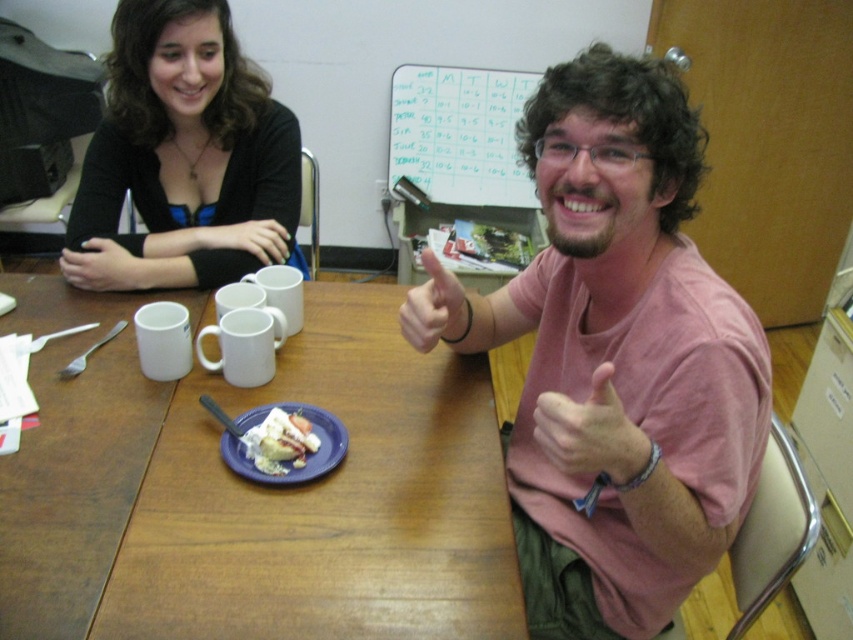
Who is positioned more to the right, pink cotton shirt at center or white creamy cake at center?

Positioned to the right is pink cotton shirt at center.

Is pink cotton shirt at center shorter than white creamy cake at center?

Incorrect, pink cotton shirt at center's height does not fall short of white creamy cake at center's.

Which is behind, point (691, 449) or point (292, 452)?

The point (292, 452) is more distant.

You are a GUI agent. You are given a task and a screenshot of the screen. Output one action in this format:
    pyautogui.click(x=<x>, y=<y>)
    Task: Click on the pink cotton shirt at center
    This screenshot has width=853, height=640.
    Given the screenshot: What is the action you would take?
    pyautogui.click(x=614, y=358)

Does black matte sweater at upper left come in front of matte black arm at upper left?

Yes, black matte sweater at upper left is closer to the viewer.

Can you confirm if black matte sweater at upper left is wider than matte black arm at upper left?

Indeed, black matte sweater at upper left has a greater width compared to matte black arm at upper left.

Is point (119, 67) positioned after point (192, 250)?

Yes, point (119, 67) is farther from viewer.

Image resolution: width=853 pixels, height=640 pixels. I want to click on black matte sweater at upper left, so click(183, 157).

Who is lower down, pink matte hand at center or matte black arm at upper left?

Positioned lower is pink matte hand at center.

This screenshot has height=640, width=853. In order to click on pink matte hand at center in this screenshot , I will do `click(593, 435)`.

You are a GUI agent. You are given a task and a screenshot of the screen. Output one action in this format:
    pyautogui.click(x=<x>, y=<y>)
    Task: Click on the pink matte hand at center
    
    Given the screenshot: What is the action you would take?
    pyautogui.click(x=593, y=435)